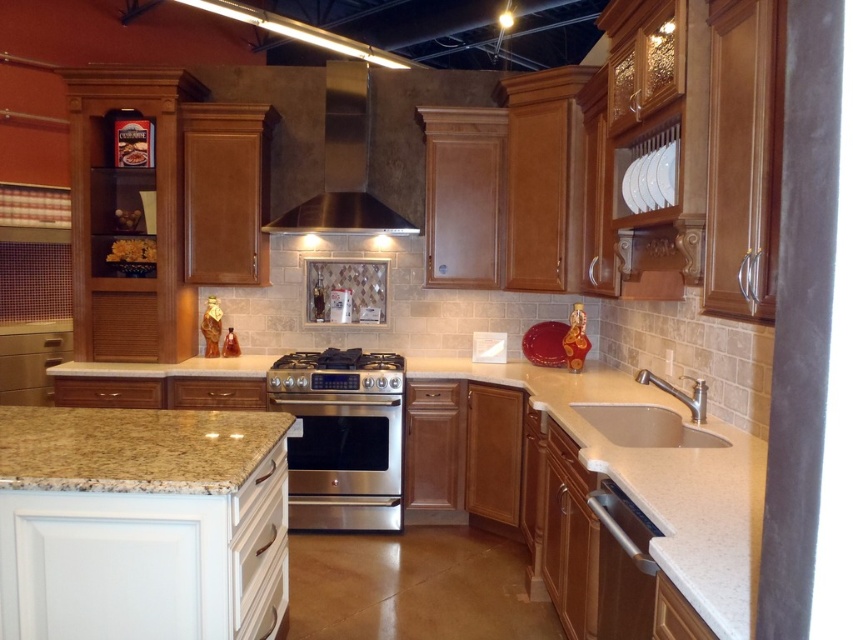
You are a kitchen designer planning to install a microwave on top of the taller appliance. Which appliance should you choose between the stainless steel oven at center and the stainless steel stove at center?

The stainless steel oven at center is taller than the stainless steel stove at center, so you should install the microwave on top of the stainless steel oven at center.

You are standing in the kitchen and want to place a small plant between the two points, point [355,408] and point [402,371]. Which point should the plant be closer to in order to be closer to the viewer?

The plant should be closer to point [355,408] because it is closer to the viewer than point [402,371].